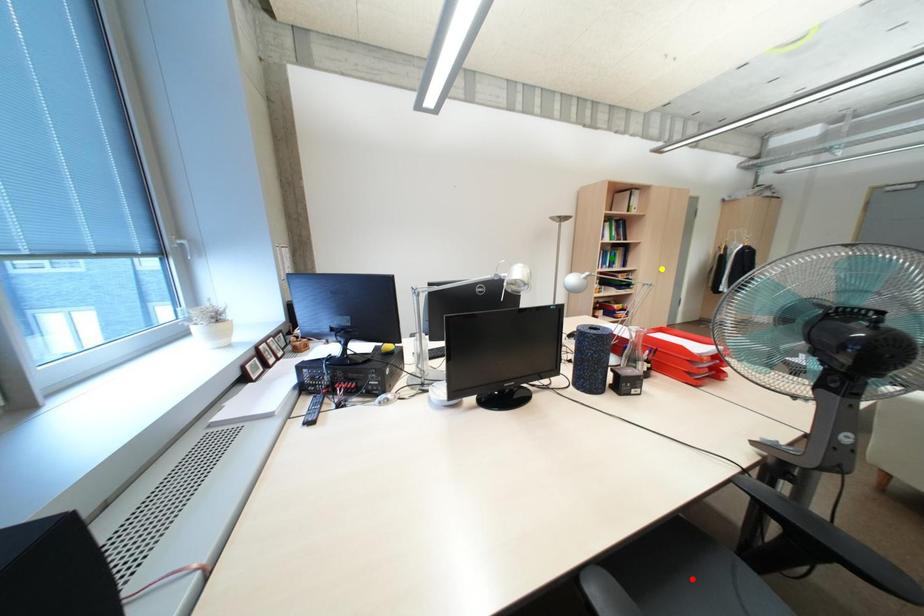
Order these from farthest to nearest:
- green point
- red point
- yellow point

yellow point
green point
red point